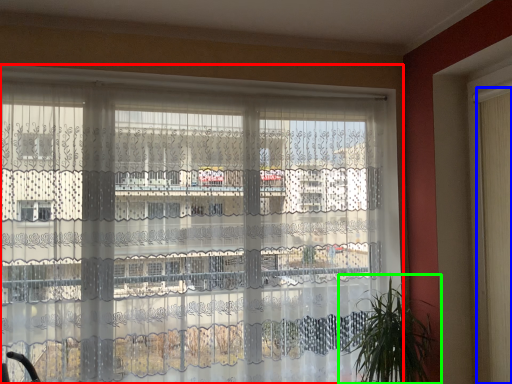
Question: Which is nearer to the window (highlighted by a red box)? shutter (highlighted by a blue box) or houseplant (highlighted by a green box).

Choices:
 (A) shutter
 (B) houseplant

Answer: (B)